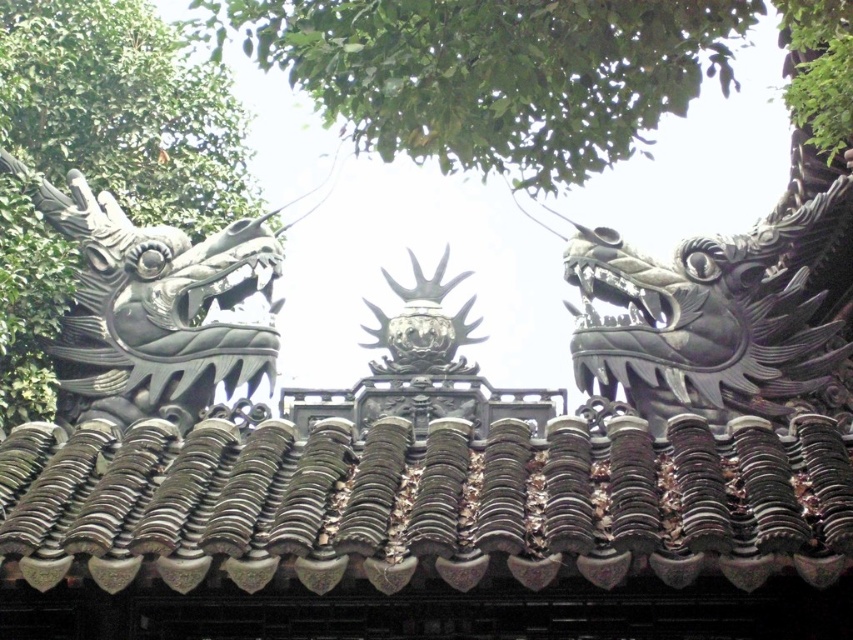
You are an architect examining the roof of an ancient temple. You notice two dragon sculptures, the shiny black dragon at right and the black matte dragon head at left. Which dragon sculpture is located to the right of the other?

The shiny black dragon at right is positioned on the right side of black matte dragon head at left.

You are standing at the base of the temple roof and see two points marked on the roof. Which point is closer to you, point [653,84] or point [219,278]?

Point [653,84] is in front of point [219,278], so it is closer to you.